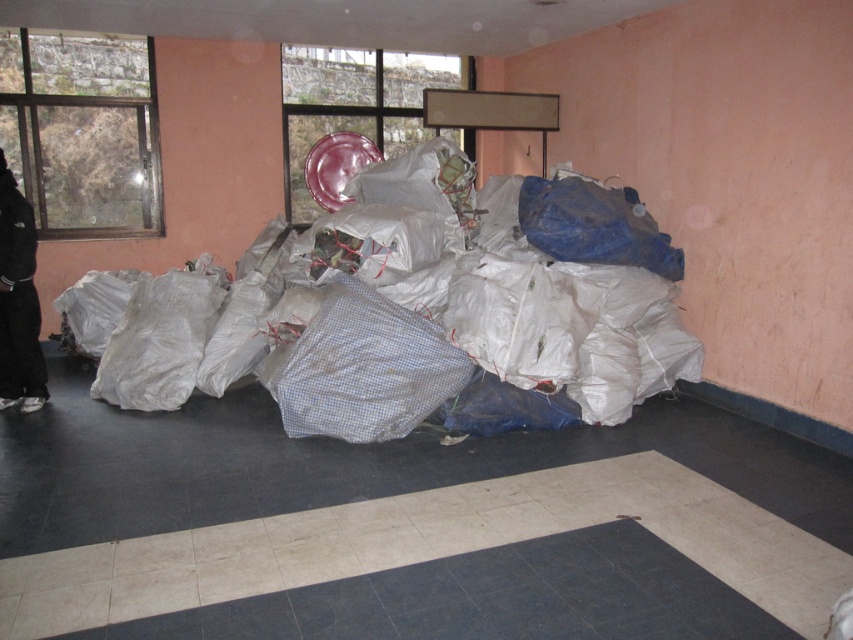
Question: From the image, what is the correct spatial relationship of white plastic bags at center in relation to black fabric pants at left?

Choices:
 (A) below
 (B) above

Answer: (B)

Question: Which of the following is the closest to the observer?

Choices:
 (A) black fabric pants at left
 (B) white plastic bags at center

Answer: (B)

Question: Which point is closer to the camera?

Choices:
 (A) white plastic bags at center
 (B) black fabric pants at left

Answer: (A)

Question: Can you confirm if white plastic bags at center is positioned above black fabric pants at left?

Choices:
 (A) yes
 (B) no

Answer: (A)

Question: Is white plastic bags at center smaller than black fabric pants at left?

Choices:
 (A) yes
 (B) no

Answer: (B)